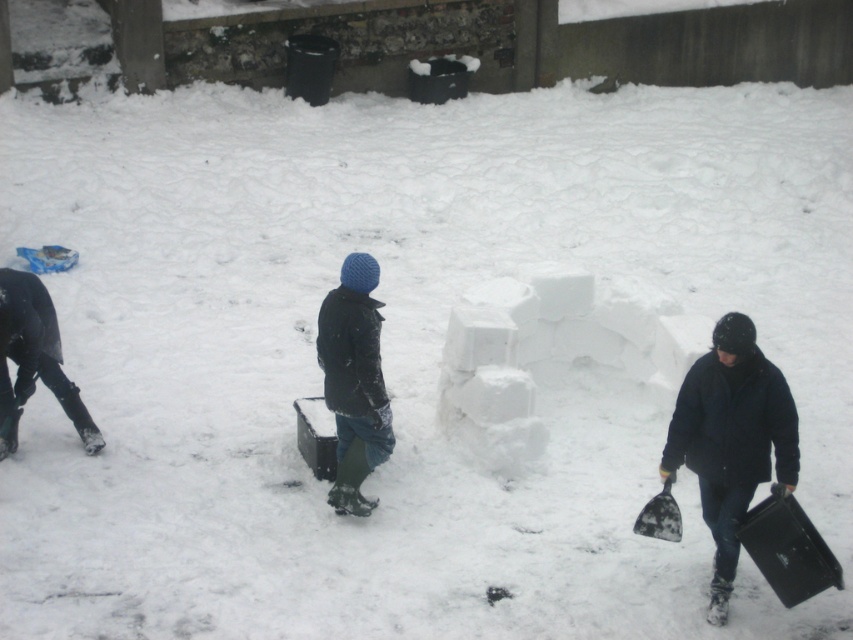
Between dark blue jacket at lower right and black matte pants at lower left, which one is positioned higher?

Positioned higher is black matte pants at lower left.

Is dark blue jacket at lower right wider than black matte pants at lower left?

In fact, dark blue jacket at lower right might be narrower than black matte pants at lower left.

The height and width of the screenshot is (640, 853). Describe the element at coordinates (730, 440) in the screenshot. I see `dark blue jacket at lower right` at that location.

Find the location of a particular element. Image resolution: width=853 pixels, height=640 pixels. dark blue jacket at lower right is located at coordinates (730, 440).

Measure the distance between black matte pants at lower left and camera.

A distance of 9.06 meters exists between black matte pants at lower left and camera.

Is black matte pants at lower left positioned in front of black plastic shovel at lower right?

No, black matte pants at lower left is further to the viewer.

Does point (9, 308) lie behind point (660, 538)?

Yes, it is behind point (660, 538).

Image resolution: width=853 pixels, height=640 pixels. Find the location of `black matte pants at lower left`. black matte pants at lower left is located at coordinates (33, 358).

Between dark blue woolen hat at center and black matte pants at lower left, which one has more height?

dark blue woolen hat at center

Which is in front, point (380, 419) or point (41, 321)?

Point (380, 419) is in front.

Is point (354, 420) more distant than point (26, 326)?

No, it is not.

Image resolution: width=853 pixels, height=640 pixels. Identify the location of dark blue woolen hat at center. (354, 381).